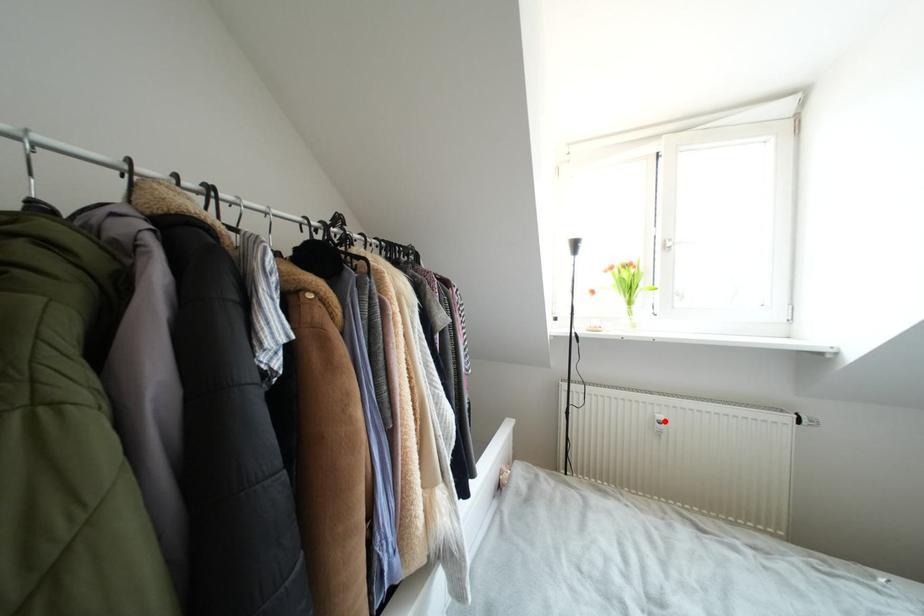
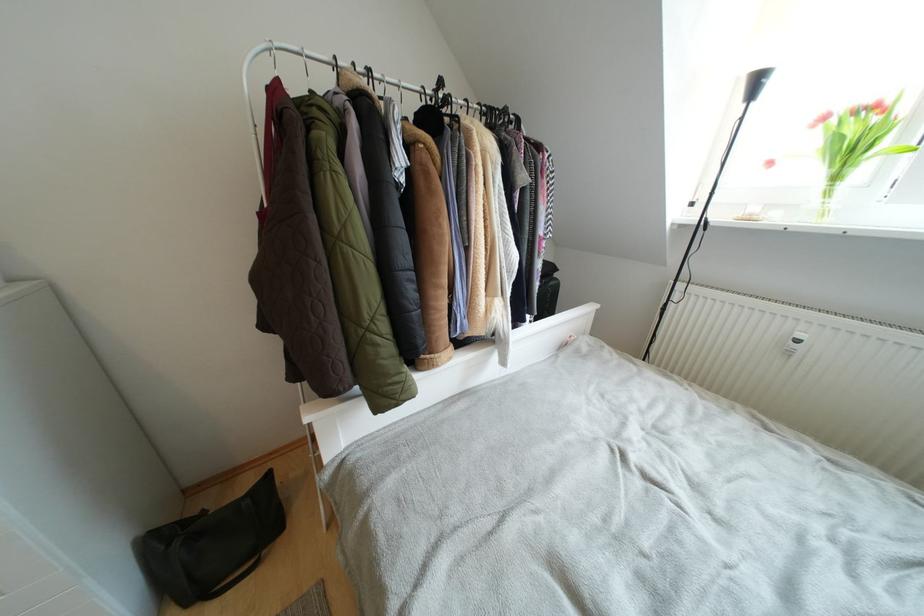
In the second image, find the point that corresponds to the highlighted location in the first image.

(805, 339)